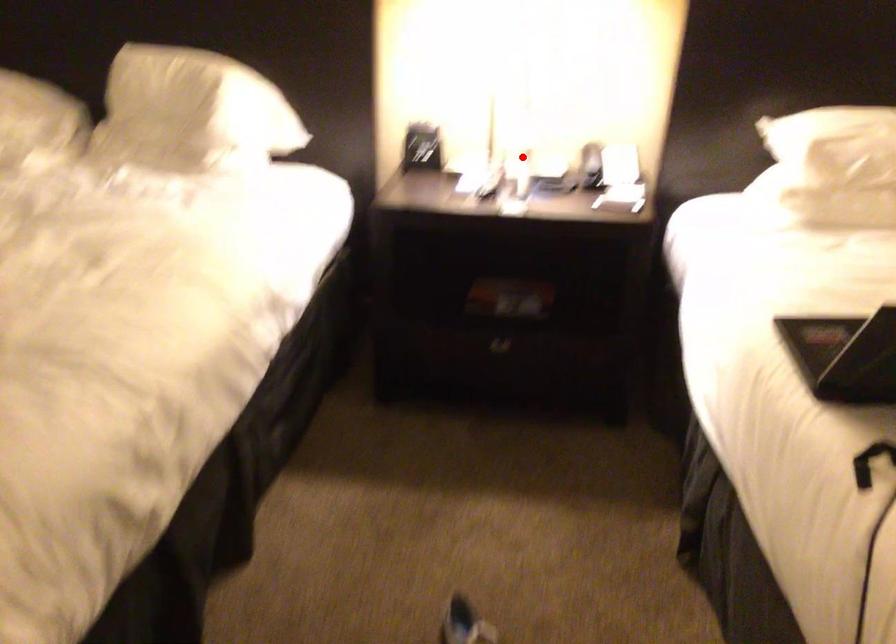
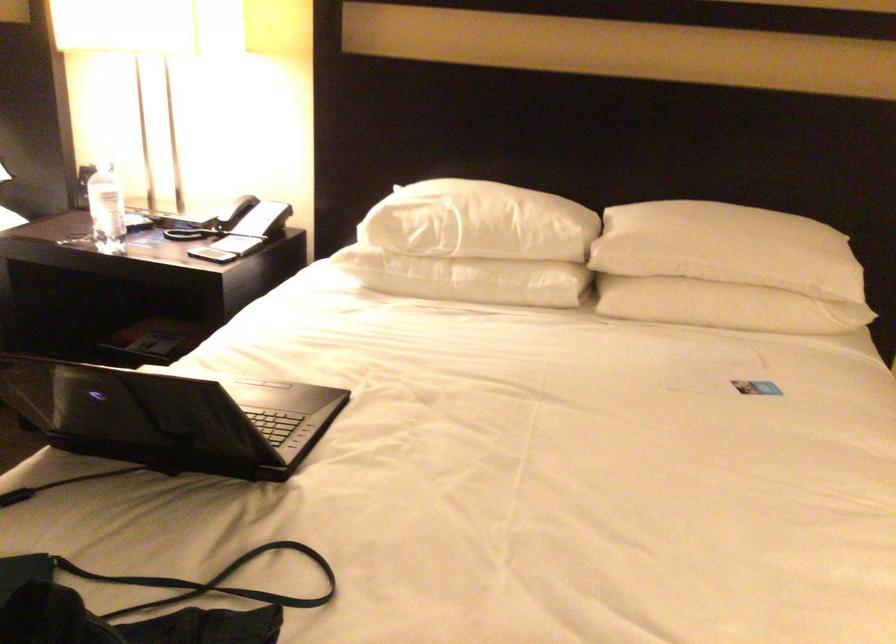
Find the pixel in the second image that matches the highlighted location in the first image.

(106, 210)